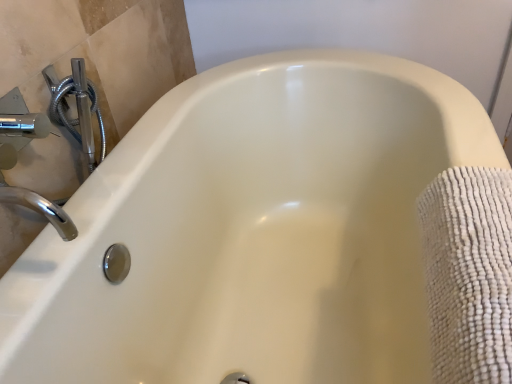
The image size is (512, 384). What do you see at coordinates (77, 109) in the screenshot? I see `chrome/metallic faucet at upper left` at bounding box center [77, 109].

Locate an element on the screen. Image resolution: width=512 pixels, height=384 pixels. chrome/metallic faucet at upper left is located at coordinates (77, 109).

Image resolution: width=512 pixels, height=384 pixels. Describe the element at coordinates (469, 273) in the screenshot. I see `white textured towel at right` at that location.

Where is `white textured towel at right`? This screenshot has width=512, height=384. white textured towel at right is located at coordinates (469, 273).

Identify the location of chrome/metallic faucet at upper left. (77, 109).

Which object is positioned more to the left, chrome/metallic faucet at upper left or white textured towel at right?

Positioned to the left is chrome/metallic faucet at upper left.

Which object is closer to the camera taking this photo, chrome/metallic faucet at upper left or white textured towel at right?

white textured towel at right is in front.

Which is more distant, (88,140) or (488,246)?

The point (88,140) is more distant.

From the image's perspective, which one is positioned lower, chrome/metallic faucet at upper left or white textured towel at right?

white textured towel at right is shown below in the image.

From a real-world perspective, which is physically below, chrome/metallic faucet at upper left or white textured towel at right?

From a 3D spatial view, white textured towel at right is below.

Can you confirm if chrome/metallic faucet at upper left is thinner than white textured towel at right?

Indeed, chrome/metallic faucet at upper left has a lesser width compared to white textured towel at right.

Considering the relative sizes of chrome/metallic faucet at upper left and white textured towel at right in the image provided, is chrome/metallic faucet at upper left taller than white textured towel at right?

Incorrect, the height of chrome/metallic faucet at upper left is not larger of that of white textured towel at right.

Does chrome/metallic faucet at upper left have a smaller size compared to white textured towel at right?

Yes, chrome/metallic faucet at upper left is smaller than white textured towel at right.

Is white textured towel at right surrounded by chrome/metallic faucet at upper left?

No, white textured towel at right is located outside of chrome/metallic faucet at upper left.

Would you consider chrome/metallic faucet at upper left to be distant from white textured towel at right?

No, there isn't a large distance between chrome/metallic faucet at upper left and white textured towel at right.

Is chrome/metallic faucet at upper left oriented away from white textured towel at right?

No, chrome/metallic faucet at upper left is not facing the opposite direction of white textured towel at right.

How many degrees apart are the facing directions of chrome/metallic faucet at upper left and white textured towel at right?

0.0644 degrees separate the facing orientations of chrome/metallic faucet at upper left and white textured towel at right.

This screenshot has width=512, height=384. In order to click on bath towel to the right of chrome/metallic faucet at upper left in this screenshot , I will do `click(469, 273)`.

Considering the relative positions of white textured towel at right and chrome/metallic faucet at upper left in the image provided, is white textured towel at right to the right of chrome/metallic faucet at upper left from the viewer's perspective?

Yes.

Between white textured towel at right and chrome/metallic faucet at upper left, which one is positioned behind?

chrome/metallic faucet at upper left is further from the camera.

Which is closer to the camera, (x=511, y=178) or (x=58, y=111)?

Positioned in front is point (x=511, y=178).

From the image's perspective, would you say white textured towel at right is positioned over chrome/metallic faucet at upper left?

No, from the image's perspective, white textured towel at right is not over chrome/metallic faucet at upper left.

From a real-world perspective, which object rests below the other?

From a 3D spatial view, white textured towel at right is below.

Considering the relative sizes of white textured towel at right and chrome/metallic faucet at upper left in the image provided, is white textured towel at right thinner than chrome/metallic faucet at upper left?

Incorrect, the width of white textured towel at right is not less than that of chrome/metallic faucet at upper left.

Is white textured towel at right taller or shorter than chrome/metallic faucet at upper left?

In the image, white textured towel at right appears to be taller than chrome/metallic faucet at upper left.

In terms of size, does white textured towel at right appear bigger or smaller than chrome/metallic faucet at upper left?

white textured towel at right is bigger than chrome/metallic faucet at upper left.

In the scene shown: Would you say white textured towel at right is inside or outside chrome/metallic faucet at upper left?

white textured towel at right is spatially situated outside chrome/metallic faucet at upper left.

Would you consider white textured towel at right to be distant from chrome/metallic faucet at upper left?

That's not correct — white textured towel at right is a little close to chrome/metallic faucet at upper left.

Is chrome/metallic faucet at upper left at the back of white textured towel at right?

Yes, white textured towel at right's orientation is away from chrome/metallic faucet at upper left.

Can you tell me how much white textured towel at right and chrome/metallic faucet at upper left differ in facing direction?

The facing directions of white textured towel at right and chrome/metallic faucet at upper left are 0.0644 degrees apart.

How far apart are white textured towel at right and chrome/metallic faucet at upper left?

The distance of white textured towel at right from chrome/metallic faucet at upper left is 29.67 inches.

Where is `plumbing fixture above the white textured towel at right (from the image's perspective)`? This screenshot has width=512, height=384. plumbing fixture above the white textured towel at right (from the image's perspective) is located at coordinates [77, 109].

At what (x,y) coordinates should I click in order to perform the action: click on plumbing fixture positioned vertically above the white textured towel at right (from a real-world perspective). Please return your answer as a coordinate pair (x, y). Image resolution: width=512 pixels, height=384 pixels. Looking at the image, I should click on (77, 109).

The image size is (512, 384). Identify the location of bath towel below the chrome/metallic faucet at upper left (from a real-world perspective). (469, 273).